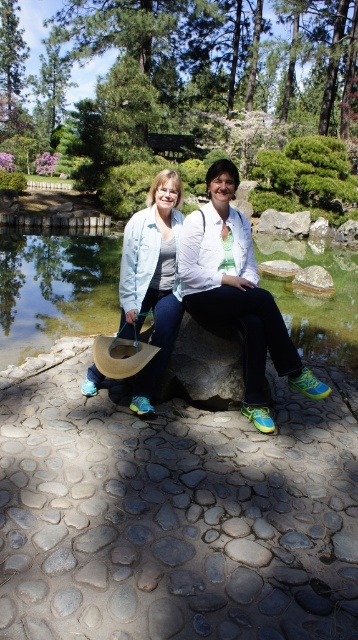
Does point (284, 332) lie behind point (142, 380)?

No.

Which is more to the left, matte white jacket at center or light blue denim jacket at center?

From the viewer's perspective, light blue denim jacket at center appears more on the left side.

Is point (202, 305) in front of point (160, 257)?

Yes, point (202, 305) is closer to viewer.

Locate an element on the screen. matte white jacket at center is located at coordinates (236, 292).

Does transparent glass lake at center have a larger size compared to light blue denim jacket at center?

Yes.

Does point (94, 321) come in front of point (167, 172)?

That is False.

Is point (36, 332) positioned before point (163, 266)?

That is False.

Image resolution: width=358 pixels, height=640 pixels. I want to click on transparent glass lake at center, so click(55, 289).

Does transparent glass lake at center have a larger size compared to matte white jacket at center?

Yes.

Does transparent glass lake at center lie in front of matte white jacket at center?

That is False.

The width and height of the screenshot is (358, 640). I want to click on transparent glass lake at center, so click(55, 289).